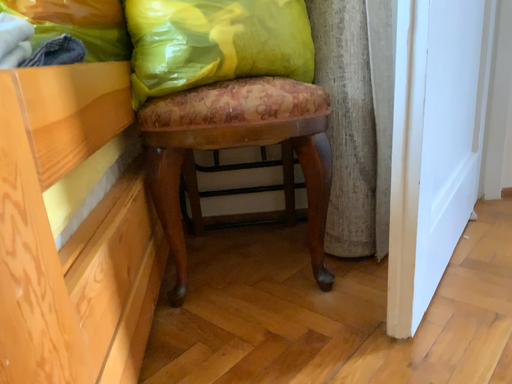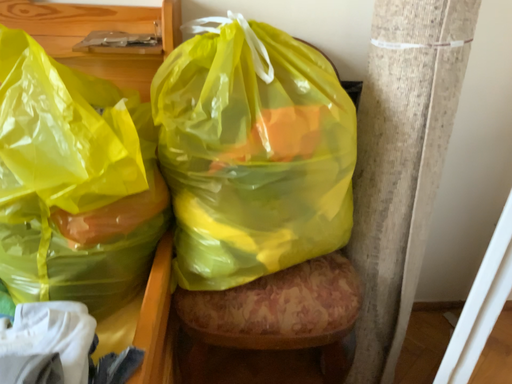
Question: How did the camera likely rotate when shooting the video?

Choices:
 (A) rotated downward
 (B) rotated upward

Answer: (A)